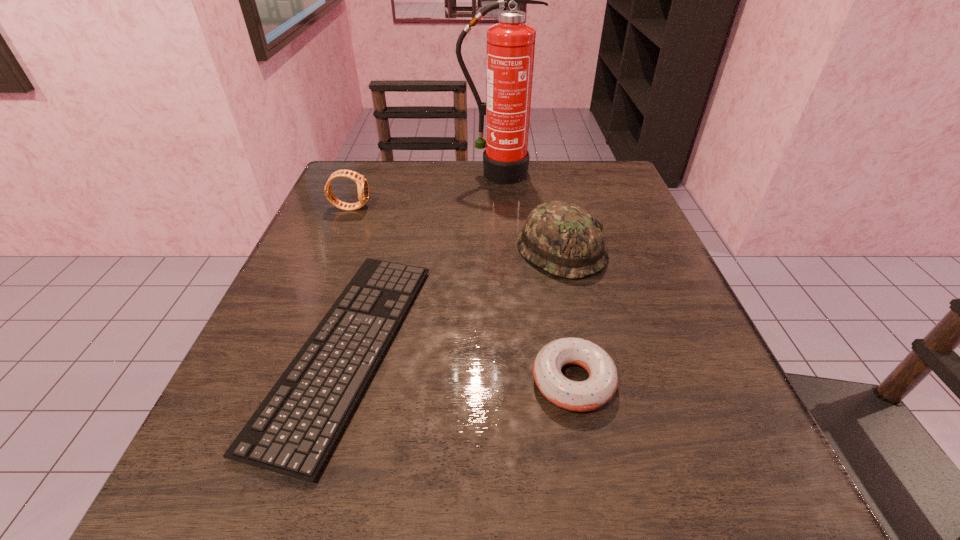
Where is `vacant space that satisfies the following two spatial constraints: 1. on the front side of the fourth tallest object; 2. on the left side of the computer keyboard`? The image size is (960, 540). vacant space that satisfies the following two spatial constraints: 1. on the front side of the fourth tallest object; 2. on the left side of the computer keyboard is located at coordinates (338, 381).

Find the location of `vacant space that satisfies the following two spatial constraints: 1. on the front-facing side of the farthest object; 2. on the right side of the fourth tallest object`. vacant space that satisfies the following two spatial constraints: 1. on the front-facing side of the farthest object; 2. on the right side of the fourth tallest object is located at coordinates (510, 381).

Identify the location of vacant space that satisfies the following two spatial constraints: 1. on the face of the watch; 2. on the left side of the computer keyboard. The width and height of the screenshot is (960, 540). (292, 348).

This screenshot has height=540, width=960. What are the coordinates of `vacant space that satisfies the following two spatial constraints: 1. on the face of the fourth nearest object; 2. on the right side of the doughnut` in the screenshot? It's located at (278, 381).

Identify the location of vacant space that satisfies the following two spatial constraints: 1. on the front-facing side of the tallest object; 2. on the left side of the headwear. This screenshot has height=540, width=960. (501, 251).